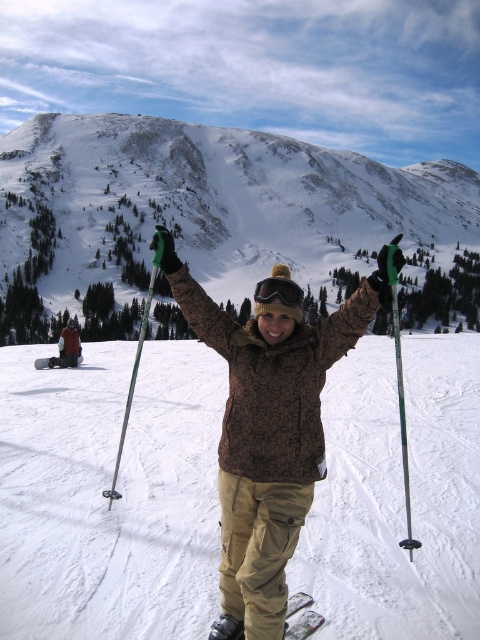
Can you confirm if snowy rocky mountain at upper center is thinner than brown fuzzy jacket at center?

No.

Is snowy rocky mountain at upper center positioned at the back of brown fuzzy jacket at center?

Yes.

What do you see at coordinates (204, 216) in the screenshot? I see `snowy rocky mountain at upper center` at bounding box center [204, 216].

I want to click on snowy rocky mountain at upper center, so click(x=204, y=216).

Can you confirm if metallic silver ski pole at center is thinner than matte black jacket at center?

No, metallic silver ski pole at center is not thinner than matte black jacket at center.

Is point (152, 296) more distant than point (72, 358)?

Yes, it is behind point (72, 358).

At what (x,y) coordinates should I click in order to perform the action: click on metallic silver ski pole at center. Please return your answer as a coordinate pair (x, y). Looking at the image, I should click on (136, 358).

Is white snow ski slope at center bigger than green plastic ski pole at center?

Actually, white snow ski slope at center might be smaller than green plastic ski pole at center.

Is white snow ski slope at center smaller than green plastic ski pole at center?

Yes.

Does point (474, 360) lie in front of point (391, 246)?

No, (474, 360) is behind (391, 246).

Find the location of `white snow ski slope at center`. white snow ski slope at center is located at coordinates (104, 499).